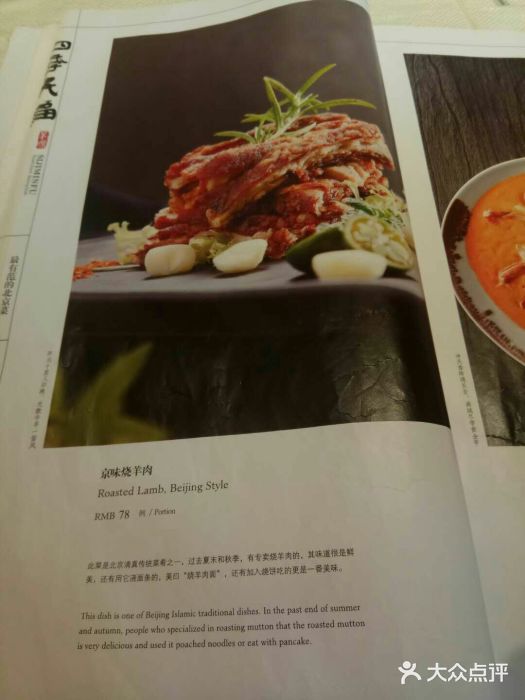
This screenshot has height=700, width=525. What are the coordinates of `white bowl` in the screenshot? It's located at (472, 185).